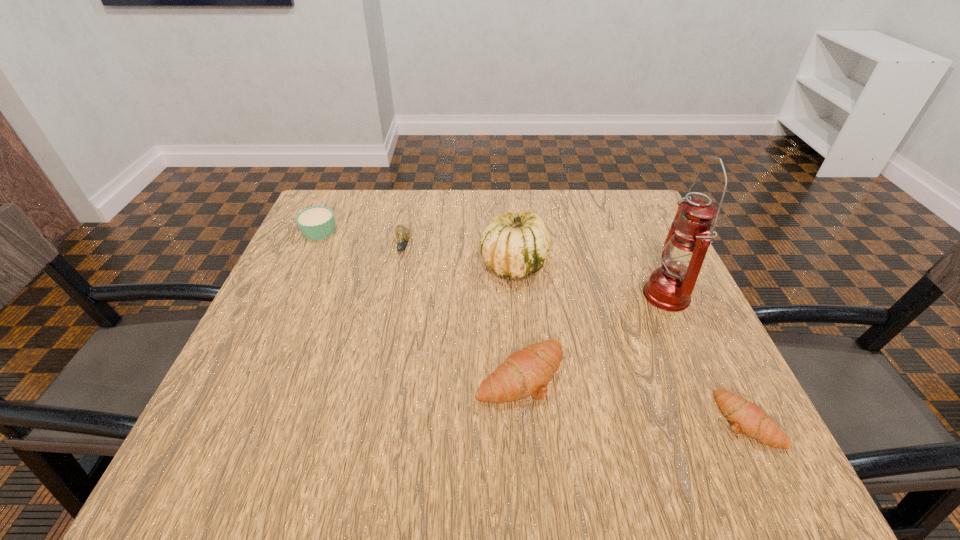
Identify the location of free space at the far edge of the desktop. (370, 223).

This screenshot has height=540, width=960. What are the coordinates of `free space at the near edge` in the screenshot? It's located at (638, 395).

Identify the location of free region at the right edge. (626, 247).

Identify the location of free location at the far left corner of the desktop. The height and width of the screenshot is (540, 960). (362, 204).

Where is `free space at the far right corner of the desktop`? free space at the far right corner of the desktop is located at coordinates (639, 213).

What are the coordinates of `free space at the near right corner of the desktop` in the screenshot? It's located at [702, 411].

You are a GUI agent. You are given a task and a screenshot of the screen. Output one action in this format:
    pyautogui.click(x=<x>, y=<y>)
    Task: Click on the vacant space that is in between the fifth object from right to left and the fifth shortest object
    Image resolution: width=960 pixels, height=540 pixels.
    Given the screenshot: What is the action you would take?
    pyautogui.click(x=458, y=255)

This screenshot has width=960, height=540. I want to click on vacant area that lies between the second tallest object and the left crescent roll, so click(x=517, y=319).

At what (x,y) coordinates should I click in order to perform the action: click on free space between the taller crescent roll and the oil lamp. Please return your answer as a coordinate pair (x, y). Looking at the image, I should click on (593, 334).

You are a GUI agent. You are given a task and a screenshot of the screen. Output one action in this format:
    pyautogui.click(x=<x>, y=<y>)
    Task: Click on the free space between the escargot and the taller crescent roll
    
    Given the screenshot: What is the action you would take?
    pyautogui.click(x=461, y=310)